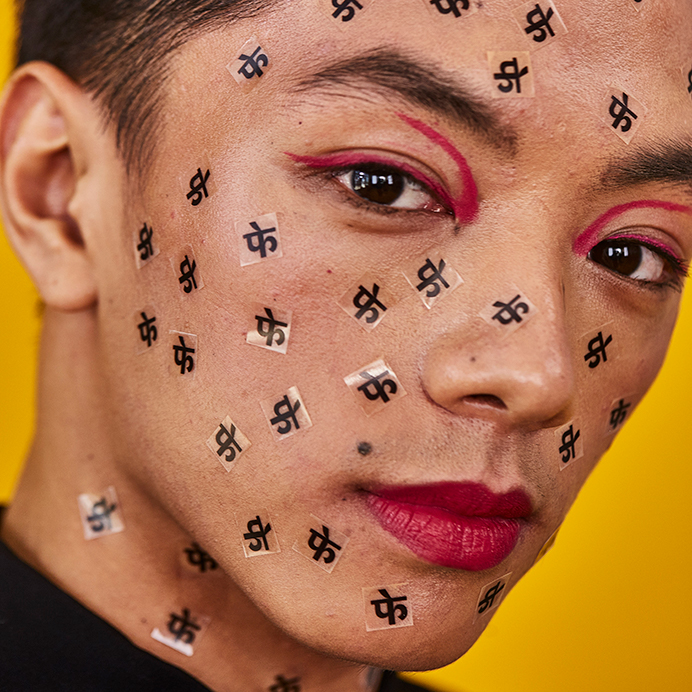
Where is `sticker`? sticker is located at coordinates (325, 553).